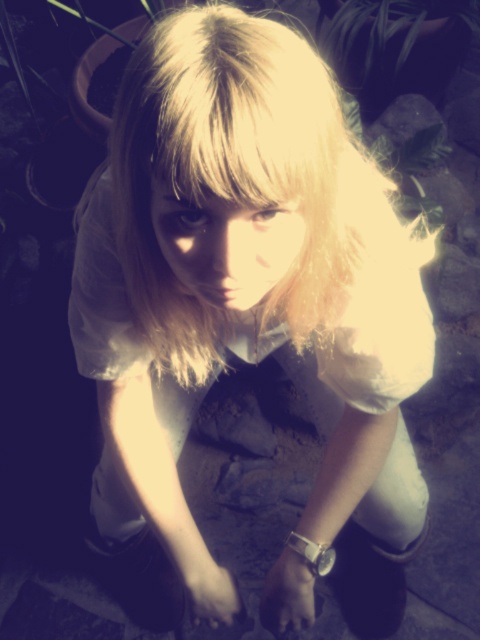
You are a photographer trying to capture a closeup shot of both the dark skin hand at center and the white matte hand at lower center. Given that your camera has a depth of field that can focus on objects within 2 inches of each other, will both hands be in focus?

The dark skin hand at center is 2.68 inches away from the white matte hand at lower center. Since the distance between them exceeds the camera lens depth of field limit of 2 inches, only one hand will be in focus at a time.

You are an artist analyzing the composition of this image. You notice the dark skin hand at center and the white matte hand at lower center. Which hand is positioned to the right side of the other?

The dark skin hand at center is positioned to the right of the white matte hand at lower center.

Based on the scene description, can you determine if the dark skin hand at center is wider than the white matte hand at lower center?

The dark skin hand at center might be wider than white matte hand at lower center according to the description.